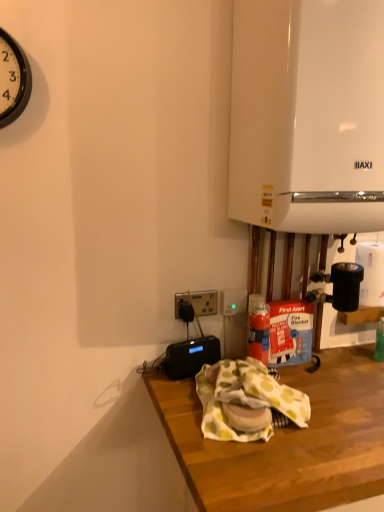
Question: Considering the relative sizes of black plastic socket at center and black plastic clock at upper left in the image provided, is black plastic socket at center bigger than black plastic clock at upper left?

Choices:
 (A) no
 (B) yes

Answer: (A)

Question: Considering the relative sizes of black plastic socket at center and black plastic clock at upper left in the image provided, is black plastic socket at center taller than black plastic clock at upper left?

Choices:
 (A) yes
 (B) no

Answer: (B)

Question: Is black plastic socket at center outside black plastic clock at upper left?

Choices:
 (A) no
 (B) yes

Answer: (B)

Question: Is black plastic socket at center smaller than black plastic clock at upper left?

Choices:
 (A) no
 (B) yes

Answer: (B)

Question: Can you confirm if black plastic socket at center is thinner than black plastic clock at upper left?

Choices:
 (A) no
 (B) yes

Answer: (B)

Question: Can you confirm if black plastic socket at center is positioned to the right of black plastic clock at upper left?

Choices:
 (A) no
 (B) yes

Answer: (B)

Question: Does black plastic socket at center appear on the right side of white matte paper towel at right?

Choices:
 (A) yes
 (B) no

Answer: (B)

Question: Can you confirm if black plastic socket at center is bigger than white matte paper towel at right?

Choices:
 (A) no
 (B) yes

Answer: (A)

Question: Is black plastic socket at center with white matte paper towel at right?

Choices:
 (A) no
 (B) yes

Answer: (A)

Question: Can you confirm if black plastic socket at center is shorter than white matte paper towel at right?

Choices:
 (A) yes
 (B) no

Answer: (A)

Question: Is white matte paper towel at right completely or partially inside black plastic socket at center?

Choices:
 (A) yes
 (B) no

Answer: (B)

Question: Is black plastic socket at center far away from white matte paper towel at right?

Choices:
 (A) yes
 (B) no

Answer: (B)

Question: Does black plastic power outlet at center have a smaller size compared to white matte paper towel at right?

Choices:
 (A) no
 (B) yes

Answer: (B)